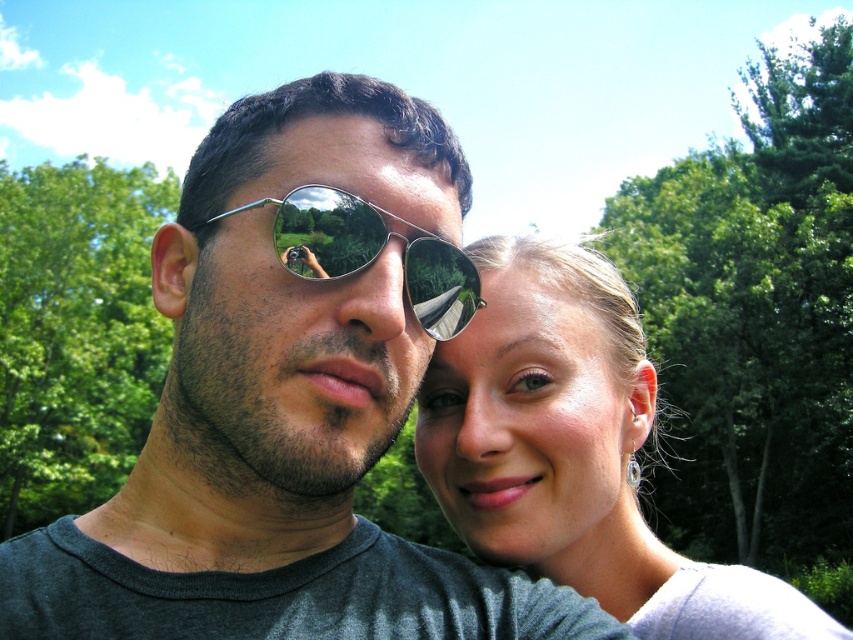
Question: Which point appears closest to the camera in this image?

Choices:
 (A) (842, 248)
 (B) (26, 429)

Answer: (A)

Question: Does green leafy tree at upper right appear under smooth skin face at right?

Choices:
 (A) yes
 (B) no

Answer: (B)

Question: Which of the following is the farthest from the observer?

Choices:
 (A) (648, 435)
 (B) (41, 228)

Answer: (B)

Question: Can you confirm if green leafy tree at left is bigger than metallic reflective sunglasses at center?

Choices:
 (A) no
 (B) yes

Answer: (B)

Question: Does green leafy tree at upper right have a lesser width compared to smooth skin face at right?

Choices:
 (A) yes
 (B) no

Answer: (B)

Question: Among these objects, which one is nearest to the camera?

Choices:
 (A) green leafy tree at left
 (B) metallic reflective sunglasses at center
 (C) matte black sunglasses at center

Answer: (C)